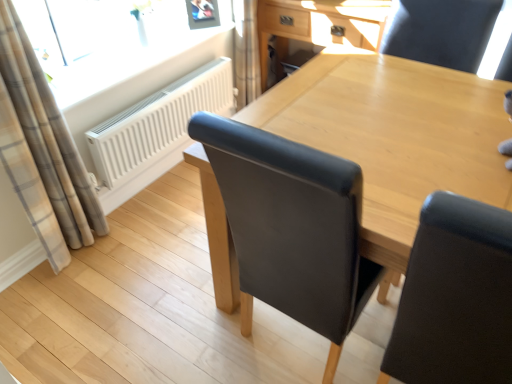
This screenshot has height=384, width=512. In order to click on vacant area to the right of plaid fabric curtain at left in this screenshot , I will do `click(130, 252)`.